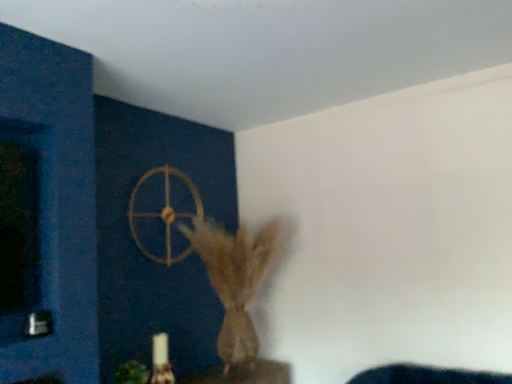
The height and width of the screenshot is (384, 512). What do you see at coordinates (132, 373) in the screenshot?
I see `green matte plant at lower left` at bounding box center [132, 373].

At what (x,y) coordinates should I click in order to perform the action: click on gold metallic wheel at upper center. Please return your answer as a coordinate pair (x, y). Looking at the image, I should click on (164, 213).

Find the location of a particular element. This screenshot has width=512, height=384. green matte plant at lower left is located at coordinates 132,373.

Measure the distance between brown textured vase at center and gold metallic wheel at upper center.

The distance of brown textured vase at center from gold metallic wheel at upper center is 13.70 inches.

Between brown textured vase at center and gold metallic wheel at upper center, which one has smaller width?

With smaller width is gold metallic wheel at upper center.

Is gold metallic wheel at upper center at the back of brown textured vase at center?

Yes, brown textured vase at center is positioned with its back facing gold metallic wheel at upper center.

Which is behind, point (246, 331) or point (167, 241)?

Point (246, 331)

Is green matte plant at lower left positioned in front of brown textured vase at center?

Yes, it is.

Can you see green matte plant at lower left touching brown textured vase at center?

There is a gap between green matte plant at lower left and brown textured vase at center.

Is green matte plant at lower left oriented towards brown textured vase at center?

No, green matte plant at lower left is not turned towards brown textured vase at center.

In terms of size, does green matte plant at lower left appear bigger or smaller than brown textured vase at center?

green matte plant at lower left is smaller than brown textured vase at center.

I want to click on plant below the brown textured vase at center (from a real-world perspective), so click(x=132, y=373).

From a real-world perspective, between brown textured vase at center and green matte plant at lower left, who is vertically higher?

In real-world perspective, brown textured vase at center is above.

Who is shorter, brown textured vase at center or green matte plant at lower left?

Standing shorter between the two is green matte plant at lower left.

Is green matte plant at lower left to the right of gold metallic wheel at upper center from the viewer's perspective?

No, green matte plant at lower left is not to the right of gold metallic wheel at upper center.

What are the coordinates of `wheel on the right side of green matte plant at lower left` in the screenshot? It's located at (164, 213).

Considering the sizes of green matte plant at lower left and gold metallic wheel at upper center in the image, is green matte plant at lower left taller or shorter than gold metallic wheel at upper center?

Clearly, green matte plant at lower left is shorter compared to gold metallic wheel at upper center.

Does point (123, 369) come farther from viewer compared to point (163, 262)?

No, it is not.

Looking at this image, is gold metallic wheel at upper center facing towards brown textured vase at center?

Yes, gold metallic wheel at upper center is oriented towards brown textured vase at center.

From the picture: From a real-world perspective, is gold metallic wheel at upper center above or below brown textured vase at center?

From a real-world perspective, gold metallic wheel at upper center is physically above brown textured vase at center.

Is point (165, 184) farther from camera compared to point (233, 352)?

That is True.

Can you confirm if gold metallic wheel at upper center is smaller than brown textured vase at center?

Yes.

Which of these two, gold metallic wheel at upper center or green matte plant at lower left, stands shorter?

Standing shorter between the two is green matte plant at lower left.

Which object is closer to the camera, gold metallic wheel at upper center or green matte plant at lower left?

green matte plant at lower left is in front.

From a real-world perspective, which is physically below, gold metallic wheel at upper center or green matte plant at lower left?

From a 3D spatial view, green matte plant at lower left is below.

I want to click on wheel above the brown textured vase at center (from a real-world perspective), so click(164, 213).

In order to click on animal above the green matte plant at lower left (from the image's perspective) in this screenshot , I will do [236, 278].

Estimate the real-world distances between objects in this image. Which object is further from green matte plant at lower left, gold metallic wheel at upper center or brown textured vase at center?

gold metallic wheel at upper center.

When comparing their distances from green matte plant at lower left, does brown textured vase at center or gold metallic wheel at upper center seem closer?

brown textured vase at center is positioned closer to the anchor green matte plant at lower left.

Looking at the image, which one is located closer to gold metallic wheel at upper center, green matte plant at lower left or brown textured vase at center?

brown textured vase at center.

From the image, which object appears to be nearer to gold metallic wheel at upper center, brown textured vase at center or green matte plant at lower left?

Among the two, brown textured vase at center is located nearer to gold metallic wheel at upper center.

Looking at the image, which one is located closer to brown textured vase at center, green matte plant at lower left or gold metallic wheel at upper center?

gold metallic wheel at upper center lies closer to brown textured vase at center than the other object.

Based on their spatial positions, is gold metallic wheel at upper center or green matte plant at lower left closer to brown textured vase at center?

gold metallic wheel at upper center is closer to brown textured vase at center.

Identify the location of animal between gold metallic wheel at upper center and green matte plant at lower left from top to bottom. The width and height of the screenshot is (512, 384). (236, 278).